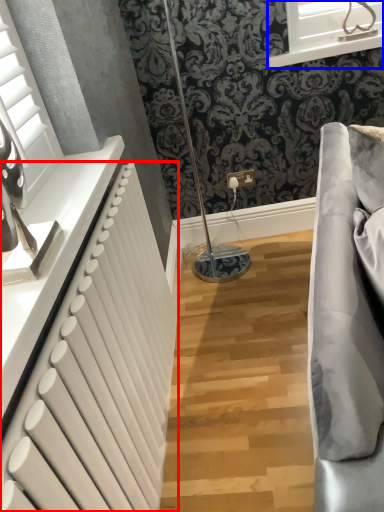
Question: Which of the following is the farthest to the observer, radiator (highlighted by a red box) or window (highlighted by a blue box)?

Choices:
 (A) radiator
 (B) window

Answer: (B)